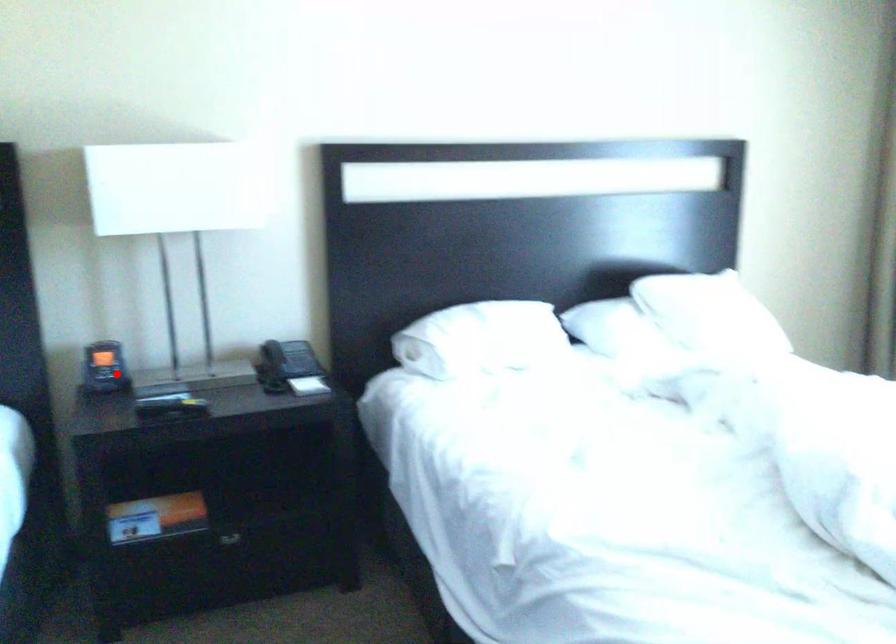
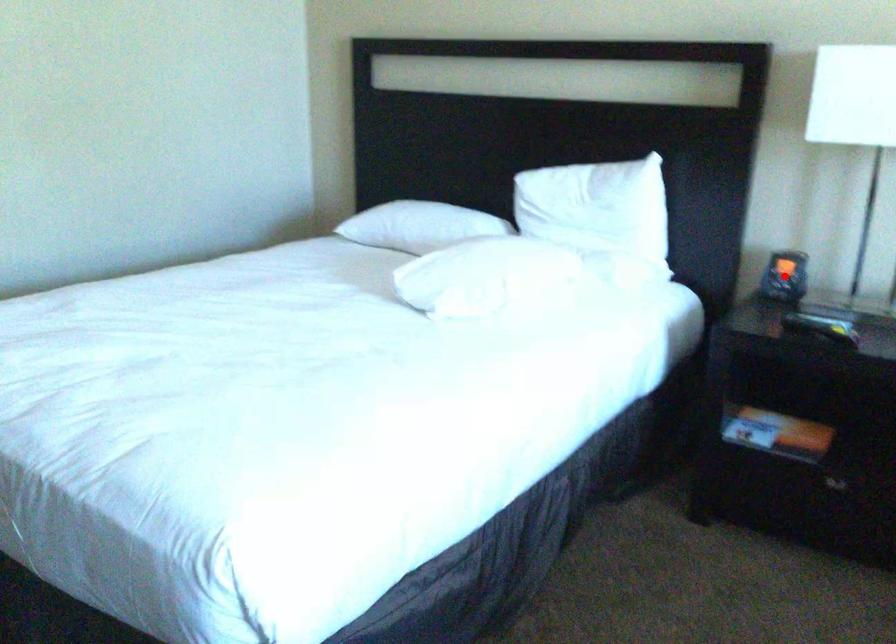
I am providing you with two images of the same scene from different viewpoints. A red point is marked on the first image and another point is marked on the second image. Is the red point in image1 aligned with the point shown in image2?

Yes